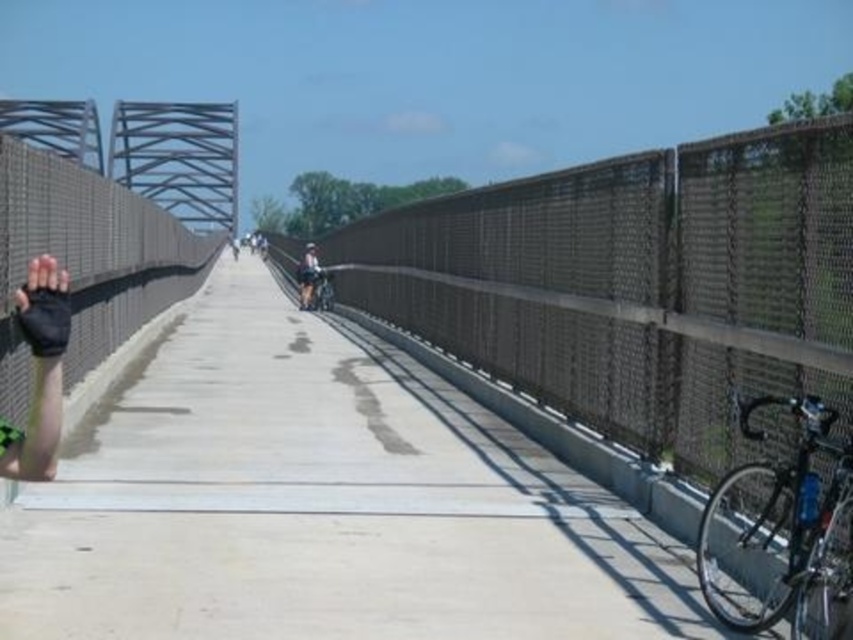
Question: Does concrete at center have a lesser width compared to shiny silver bicycle at right?

Choices:
 (A) yes
 (B) no

Answer: (B)

Question: Is concrete at center smaller than shiny silver bicycle at right?

Choices:
 (A) no
 (B) yes

Answer: (A)

Question: Among these objects, which one is farthest from the camera?

Choices:
 (A) concrete at center
 (B) shiny silver bicycle at right

Answer: (A)

Question: Which object appears farthest from the camera in this image?

Choices:
 (A) shiny silver bicycle at right
 (B) concrete at center

Answer: (B)

Question: Is concrete at center to the right of shiny silver bicycle at right from the viewer's perspective?

Choices:
 (A) yes
 (B) no

Answer: (B)